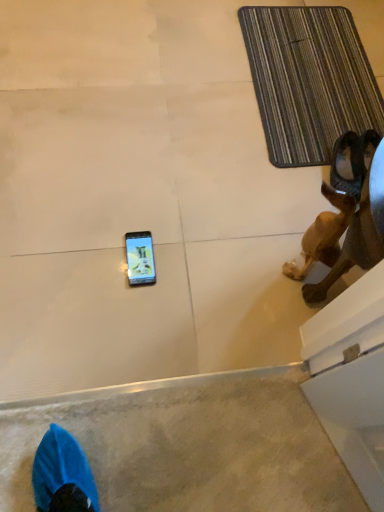
Question: From the image's perspective, is striped fabric bath mat at upper right located above or below brown leather dog at lower right?

Choices:
 (A) below
 (B) above

Answer: (B)

Question: From their relative heights in the image, would you say striped fabric bath mat at upper right is taller or shorter than brown leather dog at lower right?

Choices:
 (A) short
 (B) tall

Answer: (A)

Question: Considering the positions of striped fabric bath mat at upper right and brown leather dog at lower right in the image, is striped fabric bath mat at upper right bigger or smaller than brown leather dog at lower right?

Choices:
 (A) small
 (B) big

Answer: (A)

Question: Considering the positions of brown leather dog at lower right and striped fabric bath mat at upper right in the image, is brown leather dog at lower right bigger or smaller than striped fabric bath mat at upper right?

Choices:
 (A) big
 (B) small

Answer: (A)

Question: Considering their positions, is brown leather dog at lower right located in front of or behind striped fabric bath mat at upper right?

Choices:
 (A) front
 (B) behind

Answer: (A)

Question: Which is correct: brown leather dog at lower right is inside striped fabric bath mat at upper right, or outside of it?

Choices:
 (A) outside
 (B) inside

Answer: (A)

Question: Considering the positions of brown leather dog at lower right and striped fabric bath mat at upper right in the image, is brown leather dog at lower right taller or shorter than striped fabric bath mat at upper right?

Choices:
 (A) short
 (B) tall

Answer: (B)